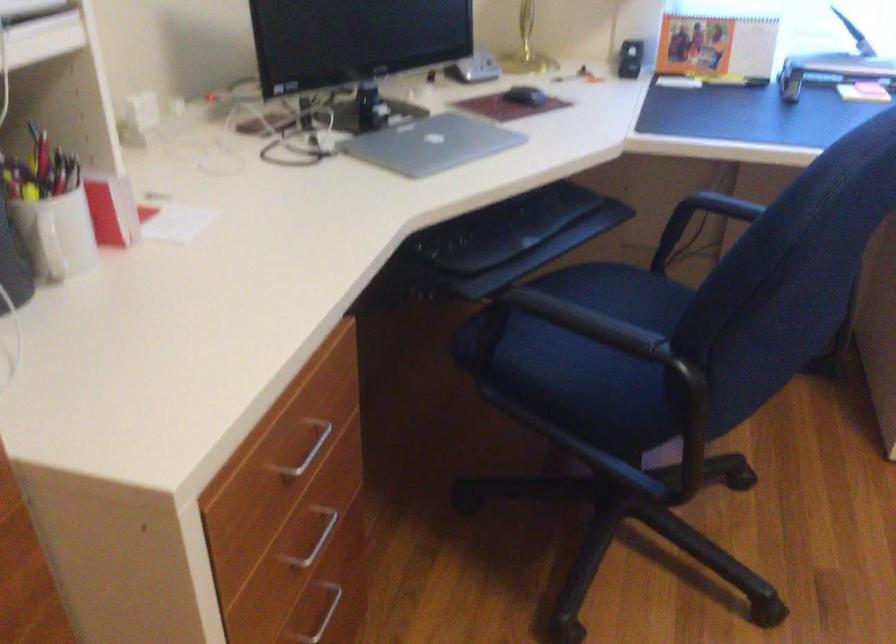
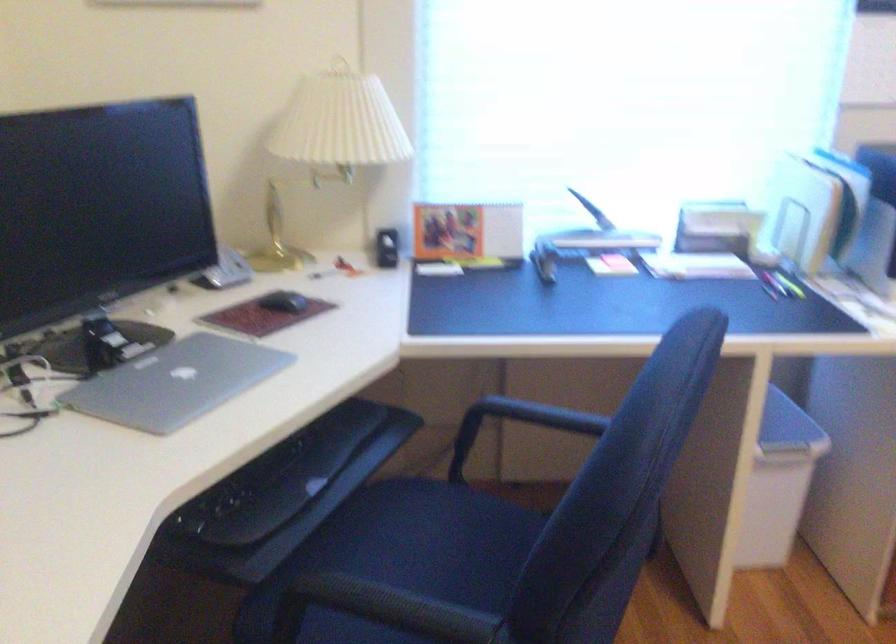
Question: In a continuous first-person perspective shot, in which direction is the camera moving?

Choices:
 (A) Left
 (B) Right
 (C) Forward
 (D) Backward

Answer: (C)